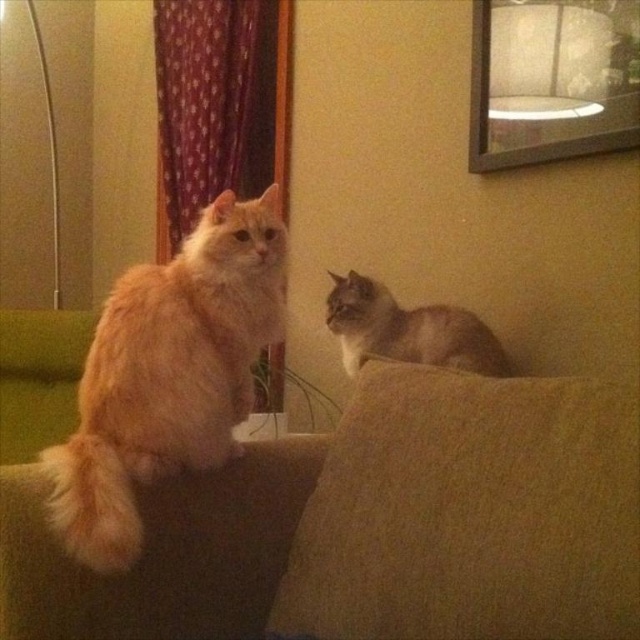
You are a cat owner who wants to hang a new picture frame on the wall near the red velvet curtain at upper left. To ensure it won not block the cat area, where exactly should you place the frame?

The red velvet curtain at upper left is located at point (202, 100), so you should place the picture frame near that coordinate to avoid blocking the cat area.

You are standing in the room and want to sit on the brown fabric couch at center. Based on its position, where should you walk towards to reach it?

The brown fabric couch at center is located at point 0.822 on the x axis and 0.581 on the y axis, so you should walk towards the coordinates (371, 525) to reach it.